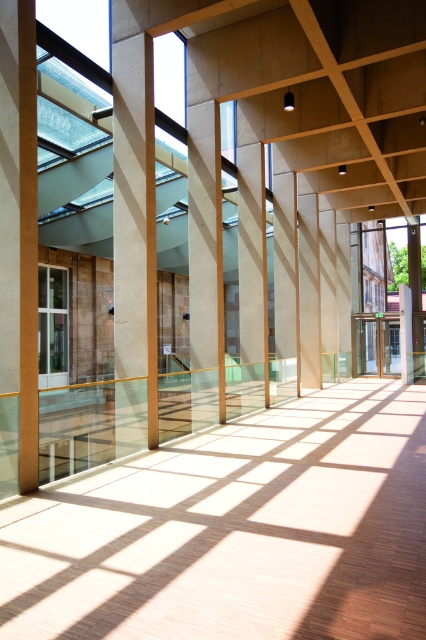
Does smooth glass floor at center have a greater width compared to concrete pillar at center?

Indeed, smooth glass floor at center has a greater width compared to concrete pillar at center.

What do you see at coordinates (236, 531) in the screenshot? I see `smooth glass floor at center` at bounding box center [236, 531].

In order to click on smooth glass floor at center in this screenshot , I will do `click(236, 531)`.